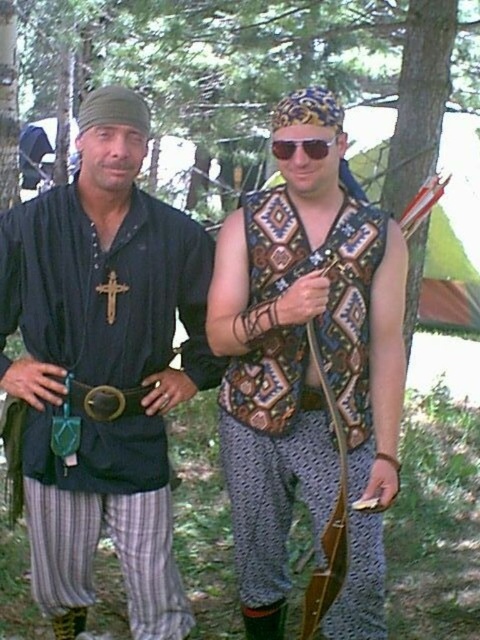
You are a costume designer examining the image of two people in historical costumes. You need to locate the brown leather belt at center. Where exactly is it positioned in the image?

The brown leather belt at center is located at point (104, 400).

You are a costume designer measuring the placement of accessories for a historical reenactment scene. You need to ensure that the brown leather belt at center is positioned correctly in the scene. If the belt is currently 2.20 meters away from the viewer, is it within the recommended 2.5 meters safety distance for closeup shots?

The brown leather belt at center is positioned 2.20 meters away from the viewer, which is within the recommended 2.5 meters safety distance for closeup shots.

You are a photographer trying to capture a closeup of the two points in the image. Which point, point (28, 243) or point (268, 387), is closer to your camera?

Point (28, 243) is closer to the camera than point (268, 387).